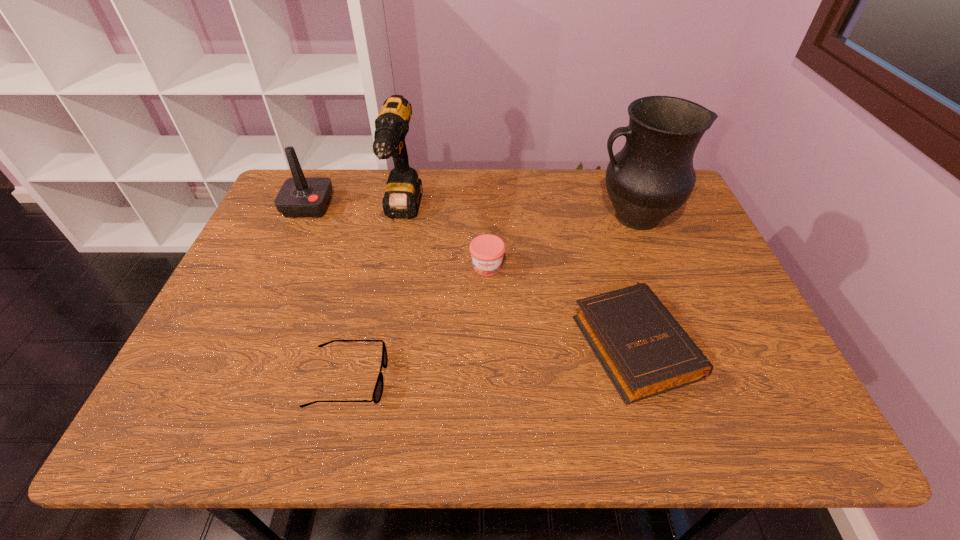
Find the location of `pitcher`. pitcher is located at coordinates (652, 176).

What are the coordinates of `drill` in the screenshot? It's located at click(402, 198).

In order to click on joystick in this screenshot , I will do `click(299, 197)`.

This screenshot has height=540, width=960. In order to click on the third tallest object in this screenshot , I will do `click(299, 197)`.

Identify the location of the fourth farthest object. (487, 251).

Where is `the fourth tallest object`? The height and width of the screenshot is (540, 960). the fourth tallest object is located at coordinates (487, 251).

You are a GUI agent. You are given a task and a screenshot of the screen. Output one action in this format:
    pyautogui.click(x=<x>, y=<y>)
    Task: Click on the fifth tallest object
    
    Given the screenshot: What is the action you would take?
    pyautogui.click(x=645, y=352)

Where is `the shortest object`? The image size is (960, 540). the shortest object is located at coordinates (378, 390).

Where is `vacant space positioned 0.390m on the handle side of the pitcher`? The height and width of the screenshot is (540, 960). vacant space positioned 0.390m on the handle side of the pitcher is located at coordinates (459, 217).

Locate an element on the screen. vacant space situated 0.350m on the handle side of the pitcher is located at coordinates (472, 217).